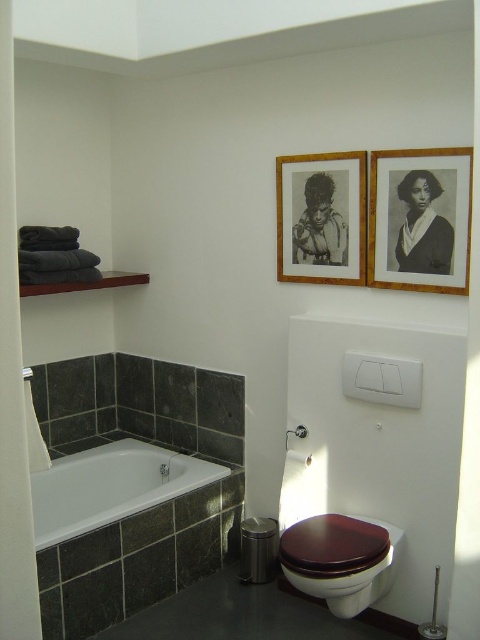
How much distance is there between white glossy bathtub at lower left and brushed metal shower at lower left?

33.91 inches

Is white glossy bathtub at lower left closer to camera compared to brushed metal shower at lower left?

Yes, it is in front of brushed metal shower at lower left.

Is point (68, 464) farther from camera compared to point (286, 445)?

Yes, it is behind point (286, 445).

Where is `white glossy bathtub at lower left`? The image size is (480, 640). white glossy bathtub at lower left is located at coordinates point(110,486).

In the scene shown: Does wooden picture frame at upper right appear on the left side of brushed metal shower at lower left?

Incorrect, wooden picture frame at upper right is not on the left side of brushed metal shower at lower left.

Is wooden picture frame at upper right below brushed metal shower at lower left?

Incorrect, wooden picture frame at upper right is not positioned below brushed metal shower at lower left.

Is point (441, 259) closer to camera compared to point (295, 433)?

Yes, point (441, 259) is closer to viewer.

At what (x,y) coordinates should I click in order to perform the action: click on wooden picture frame at upper right. Please return your answer as a coordinate pair (x, y). Looking at the image, I should click on (420, 220).

Is wooden picture frame at upper center thinner than brown glossy toilet at lower right?

Yes.

Describe the element at coordinates (322, 218) in the screenshot. I see `wooden picture frame at upper center` at that location.

Is point (295, 173) less distant than point (368, 536)?

No, it is not.

You are a GUI agent. You are given a task and a screenshot of the screen. Output one action in this format:
    pyautogui.click(x=<x>, y=<y>)
    Task: Click on the wooden picture frame at upper center
    This screenshot has width=480, height=640.
    Given the screenshot: What is the action you would take?
    pyautogui.click(x=322, y=218)